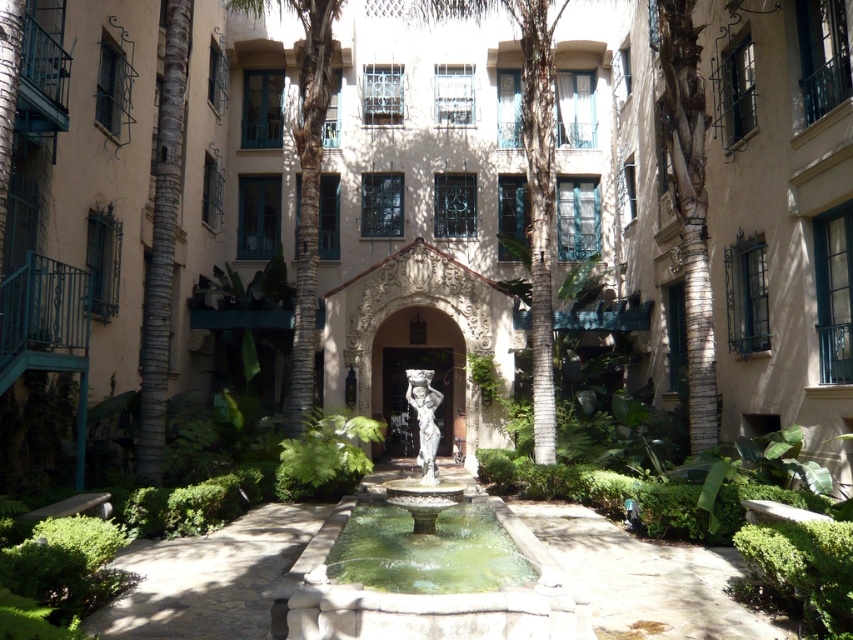
Question: Does white stone fountain at center have a lesser width compared to green leafy palm tree at center?

Choices:
 (A) yes
 (B) no

Answer: (A)

Question: Which point is farther to the camera?

Choices:
 (A) green stone pool at center
 (B) white stone fountain at center
 (C) green leafy palm tree at center

Answer: (C)

Question: Which object is closer to the camera taking this photo?

Choices:
 (A) white stone fountain at center
 (B) green leafy palm tree at center
 (C) green stone pool at center

Answer: (A)

Question: Estimate the real-world distances between objects in this image. Which object is farther from the white stone fountain at center?

Choices:
 (A) green leafy palm tree at center
 (B) green stone pool at center

Answer: (A)

Question: In this image, where is white stone fountain at center located relative to green leafy palm tree at center?

Choices:
 (A) above
 (B) below

Answer: (B)

Question: Can you confirm if white stone fountain at center is positioned above green leafy palm tree at center?

Choices:
 (A) yes
 (B) no

Answer: (B)